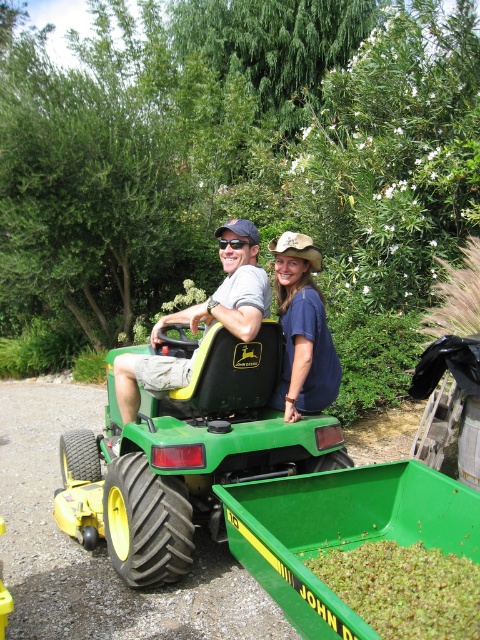
You are standing in the garden and want to take a photo of the green rubber lawn mower at center and the blue cotton shirt at center. Which object should you focus on first if you want both to be in sharp focus?

The green rubber lawn mower at center is closer to the viewer than the blue cotton shirt at center. To have both in sharp focus, focus on the green rubber lawn mower at center since it is closer, and the blue cotton shirt at center will be in focus as well if within the depth of field.

You are standing in the yard and see the matte black tractor at center and the blue cotton shirt at center. Which object is closer to the ground?

The matte black tractor at center is closer to the ground because it is positioned below the blue cotton shirt at center.

You are a delivery person who needs to place a 12 inch long package between the matte black tractor at center and the blue cotton shirt at center. Can the package fit in the space between them?

The distance between the matte black tractor at center and the blue cotton shirt at center is 16.15 inches, so the 12 inch long package can fit in the space between them since it is shorter than the available distance.